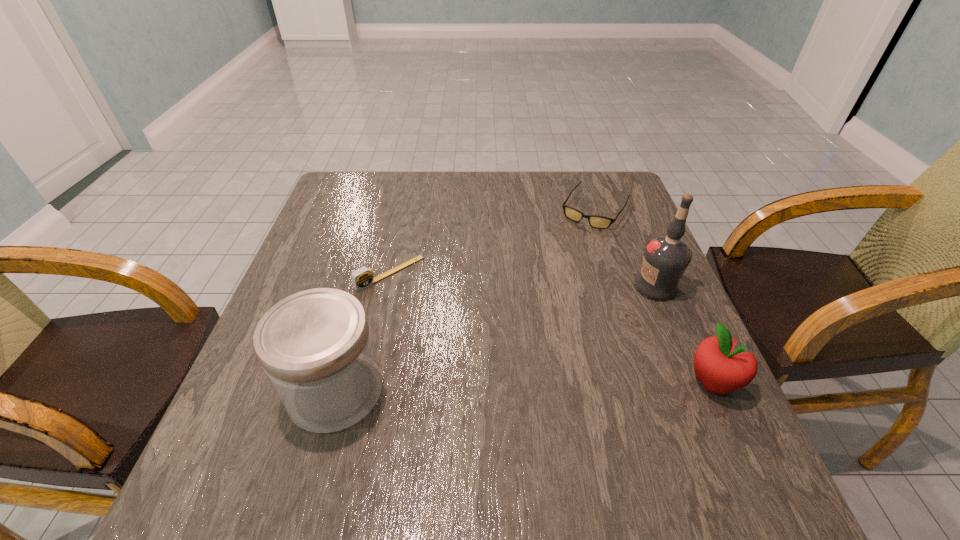
Identify which object is the fourth closest to the farthest object. Please provide its 2D coordinates. Your answer should be formatted as a tuple, i.e. [(x, y)], where the tuple contains the x and y coordinates of a point satisfying the conditions above.

[(316, 348)]

At what (x,y) coordinates should I click in order to perform the action: click on the closest object relative to the apple. Please return your answer as a coordinate pair (x, y). The image size is (960, 540). Looking at the image, I should click on (666, 257).

Where is `free location that satisfies the following two spatial constraints: 1. on the front side of the vodka; 2. on the right side of the tape measure`? The image size is (960, 540). free location that satisfies the following two spatial constraints: 1. on the front side of the vodka; 2. on the right side of the tape measure is located at coordinates (387, 287).

Locate an element on the screen. Image resolution: width=960 pixels, height=540 pixels. free space that satisfies the following two spatial constraints: 1. on the front side of the third tallest object; 2. on the left side of the tape measure is located at coordinates (366, 382).